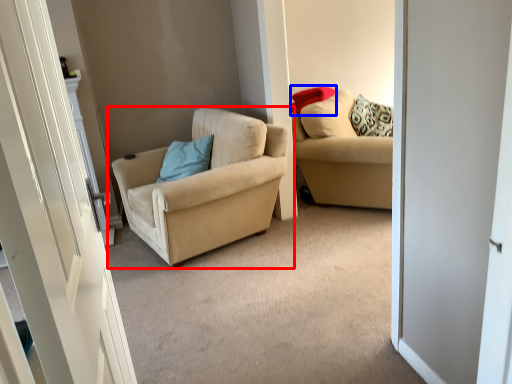
Question: Which of the following is the farthest to the observer, chair (highlighted by a red box) or pillow (highlighted by a blue box)?

Choices:
 (A) chair
 (B) pillow

Answer: (B)